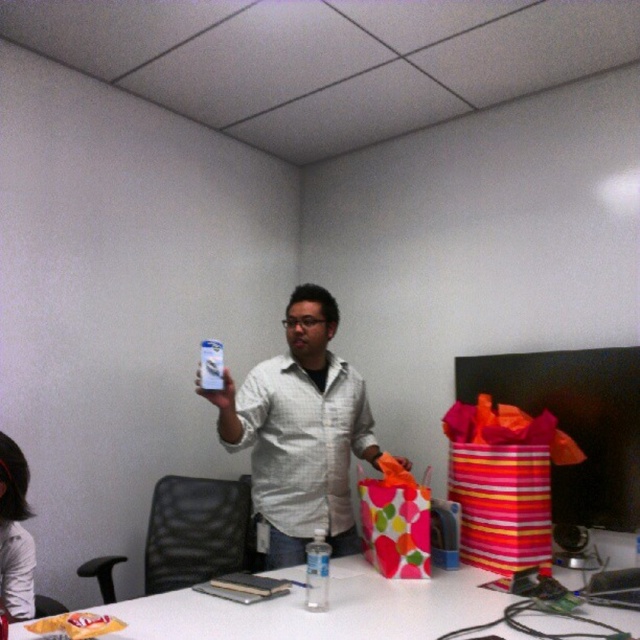
Question: Which object is positioned closest to the polka dot paper bag at center?

Choices:
 (A) white fabric shirt at lower left
 (B) clear plastic bottle at center
 (C) white glossy can at center
 (D) white glossy table at center

Answer: (C)

Question: Does white fabric shirt at lower left appear on the left side of clear plastic bottle at center?

Choices:
 (A) no
 (B) yes

Answer: (B)

Question: Is white glossy table at center smaller than clear plastic bottle at center?

Choices:
 (A) yes
 (B) no

Answer: (B)

Question: Which of these objects is positioned farthest from the white fabric shirt at lower left?

Choices:
 (A) white glossy table at center
 (B) clear plastic bottle at center
 (C) matte plastic bottle at upper center

Answer: (B)

Question: Considering the relative positions of white glossy table at center and polka dot paper bag at center in the image provided, where is white glossy table at center located with respect to polka dot paper bag at center?

Choices:
 (A) right
 (B) left

Answer: (B)

Question: Which point is closer to the camera?

Choices:
 (A) (227, 371)
 (B) (308, 586)
 (C) (426, 506)
 (D) (33, 561)

Answer: (B)